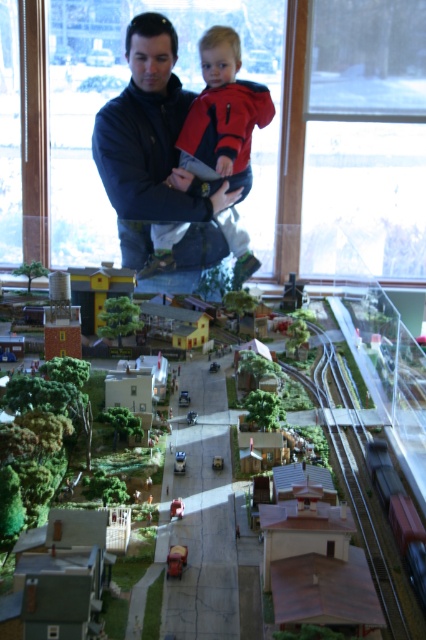
Is dark blue jacket at upper center closer to camera compared to red matte train car at bottom right?

No.

Can you confirm if dark blue jacket at upper center is positioned to the left of red matte train car at bottom right?

Yes, dark blue jacket at upper center is to the left of red matte train car at bottom right.

Image resolution: width=426 pixels, height=640 pixels. Identify the location of dark blue jacket at upper center. [x=152, y=154].

Which is above, dark blue jacket at upper center or metallic red fire truck at center?

Positioned higher is dark blue jacket at upper center.

The width and height of the screenshot is (426, 640). In order to click on dark blue jacket at upper center in this screenshot , I will do `click(152, 154)`.

Does point (160, 164) come behind point (178, 566)?

Yes, point (160, 164) is farther from viewer.

I want to click on dark blue jacket at upper center, so click(x=152, y=154).

Is red matte train car at bottom right positioned before metallic red car at center?

Yes, it is in front of metallic red car at center.

Between red matte train car at bottom right and metallic red car at center, which one is positioned lower?

metallic red car at center is lower down.

The image size is (426, 640). Find the location of `red matte train car at bottom right`. red matte train car at bottom right is located at coordinates (399, 513).

You are a GUI agent. You are given a task and a screenshot of the screen. Output one action in this format:
    pyautogui.click(x=<x>, y=<y>)
    Task: Click on the red matte train car at bottom right
    This screenshot has width=426, height=640.
    Given the screenshot: What is the action you would take?
    pyautogui.click(x=399, y=513)